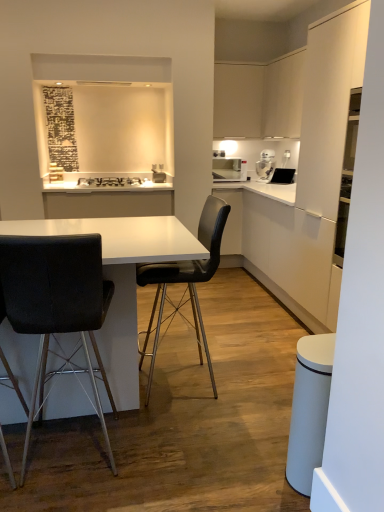
The image size is (384, 512). Find the location of `unoccupied area behind black leather chair at center, arranged as the first chair when viewed from the right`. unoccupied area behind black leather chair at center, arranged as the first chair when viewed from the right is located at coordinates (193, 345).